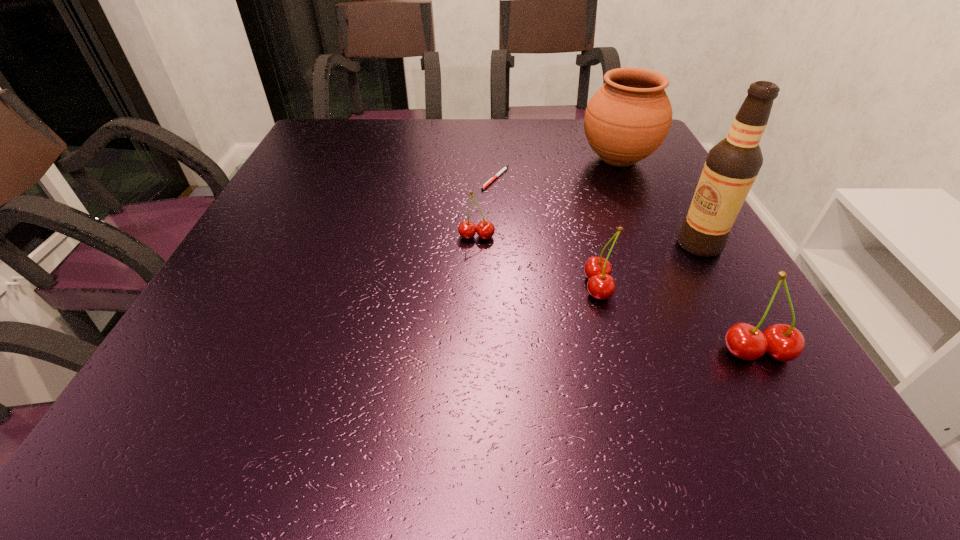
This screenshot has width=960, height=540. What are the coordinates of `free space between the pen and the second tallest object` in the screenshot? It's located at (557, 169).

You are a GUI agent. You are given a task and a screenshot of the screen. Output one action in this format:
    pyautogui.click(x=<x>, y=<y>)
    Task: Click on the object that is the second closest to the second shortest cherry
    The image size is (960, 540).
    Given the screenshot: What is the action you would take?
    pyautogui.click(x=732, y=165)

This screenshot has height=540, width=960. I want to click on object that stands as the fourth closest to the pottery, so click(x=601, y=286).

Image resolution: width=960 pixels, height=540 pixels. Find the location of `cherry that is the second closest to the pottery`. cherry that is the second closest to the pottery is located at coordinates (601, 286).

Find the location of `the second closest cherry to the tallest cherry`. the second closest cherry to the tallest cherry is located at coordinates (467, 229).